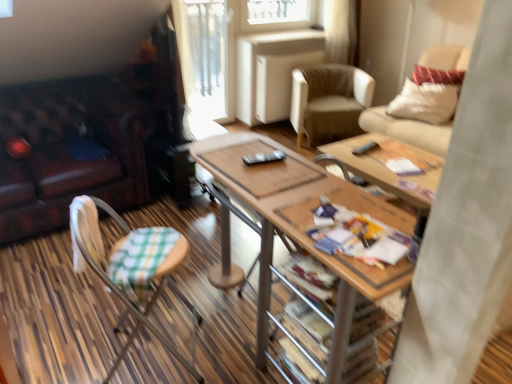
Identify the location of free space that is to the left of green checkered fabric chair at lower left, the third chair from the top. The image size is (512, 384). (72, 342).